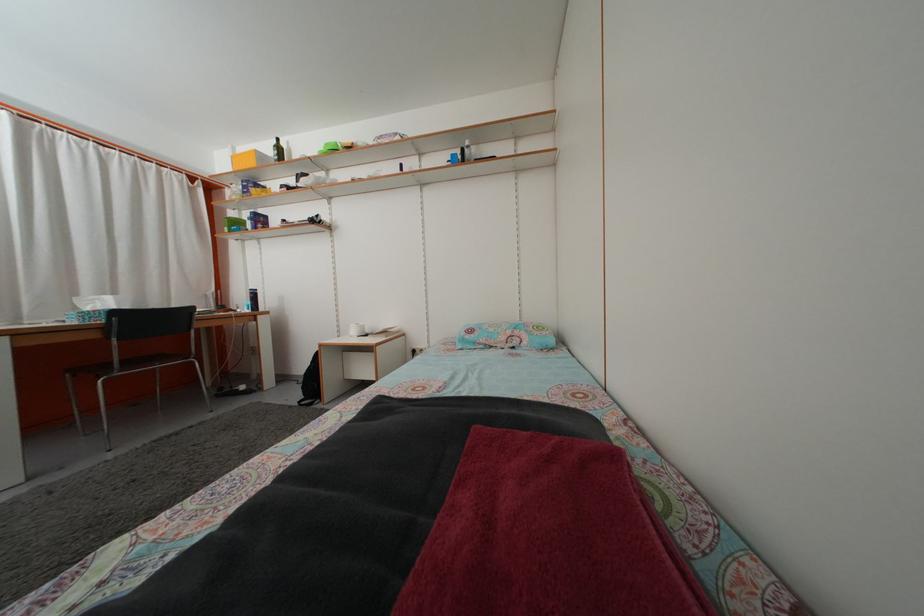
Find where to lift the green cardboard box. Please return your answer as a coordinate pair (x, y).

(234, 224)